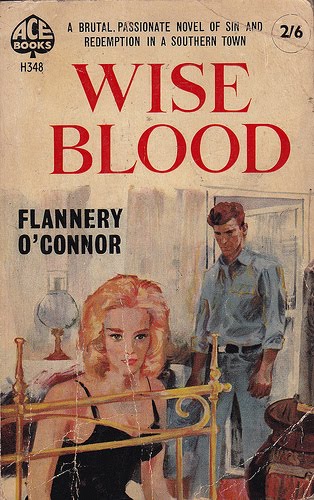
You are a GUI agent. You are given a task and a screenshot of the screen. Output one action in this format:
    pyautogui.click(x=<x>, y=<y>)
    Task: Click on the door
    The width and height of the screenshot is (314, 500).
    Given the screenshot: What is the action you would take?
    pyautogui.click(x=269, y=226)